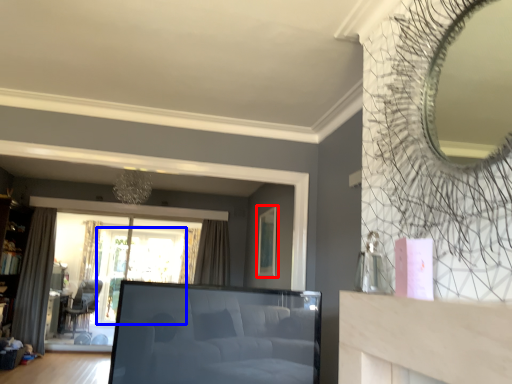
Question: Which object is closer to the camera taking this photo, picture frame (highlighted by a red box) or window screen (highlighted by a blue box)?

Choices:
 (A) picture frame
 (B) window screen

Answer: (A)